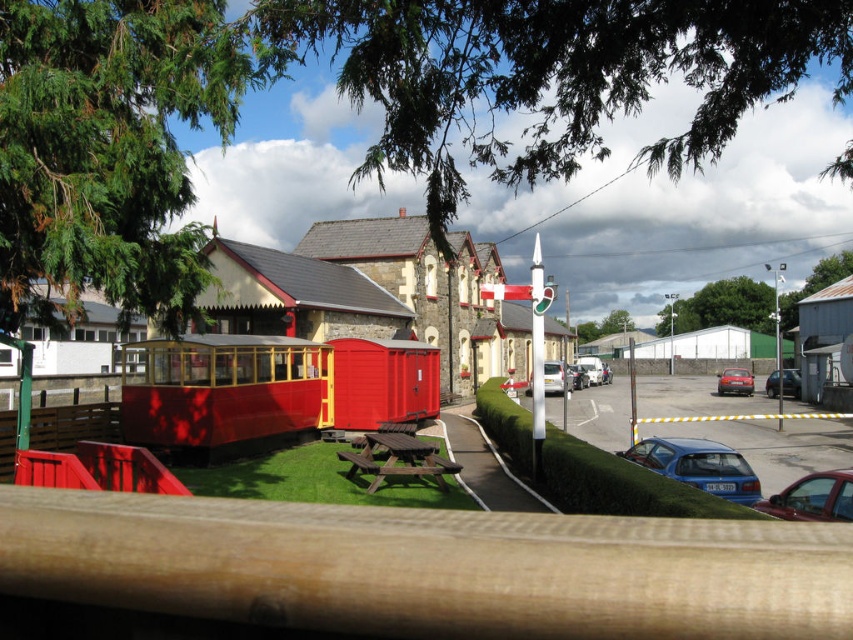
Can you confirm if smooth red train at center is shorter than brown wooden picnic table at center?

No.

Is smooth red train at center above brown wooden picnic table at center?

Correct, smooth red train at center is located above brown wooden picnic table at center.

The height and width of the screenshot is (640, 853). What do you see at coordinates (270, 387) in the screenshot?
I see `smooth red train at center` at bounding box center [270, 387].

Find the location of a particular element. This screenshot has width=853, height=640. smooth red train at center is located at coordinates (270, 387).

In the scene shown: Can you confirm if smooth red train at center is smaller than smooth red train car at center?

No.

Is point (131, 387) in front of point (357, 368)?

Yes, it is.

Find the location of a particular element. smooth red train at center is located at coordinates (270, 387).

At what (x,y) coordinates should I click in order to perform the action: click on smooth red train car at center. Please return your answer as a coordinate pair (x, y). Image resolution: width=853 pixels, height=640 pixels. Looking at the image, I should click on (383, 381).

Does smooth red train car at center have a larger size compared to metallic blue car at center?

Incorrect, smooth red train car at center is not larger than metallic blue car at center.

At what (x,y) coordinates should I click in order to perform the action: click on smooth red train car at center. Please return your answer as a coordinate pair (x, y). The height and width of the screenshot is (640, 853). Looking at the image, I should click on (383, 381).